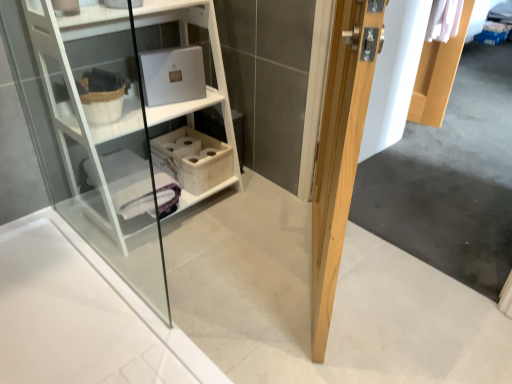
Question: From a real-world perspective, does white wood shelf at upper left sit lower than natural wood door at right?

Choices:
 (A) no
 (B) yes

Answer: (B)

Question: Does white wood shelf at upper left have a greater height compared to natural wood door at right?

Choices:
 (A) no
 (B) yes

Answer: (A)

Question: Is white wood shelf at upper left surrounding natural wood door at right?

Choices:
 (A) no
 (B) yes

Answer: (A)

Question: From a real-world perspective, is white wood shelf at upper left on natural wood door at right?

Choices:
 (A) no
 (B) yes

Answer: (A)

Question: Is white wood shelf at upper left placed right next to natural wood door at right?

Choices:
 (A) yes
 (B) no

Answer: (B)

Question: Does white wood shelf at upper left have a larger size compared to natural wood door at right?

Choices:
 (A) yes
 (B) no

Answer: (A)

Question: Is natural wood door at right looking in the opposite direction of white wood shelf at upper left?

Choices:
 (A) no
 (B) yes

Answer: (B)

Question: Is natural wood door at right placed right next to white wood shelf at upper left?

Choices:
 (A) yes
 (B) no

Answer: (B)

Question: Does natural wood door at right contain white wood shelf at upper left?

Choices:
 (A) no
 (B) yes

Answer: (A)

Question: Is natural wood door at right completely or partially outside of white wood shelf at upper left?

Choices:
 (A) no
 (B) yes

Answer: (B)

Question: Is natural wood door at right to the right of white wood shelf at upper left from the viewer's perspective?

Choices:
 (A) yes
 (B) no

Answer: (A)

Question: Considering the relative positions of natural wood door at right and white wood shelf at upper left in the image provided, is natural wood door at right to the left of white wood shelf at upper left from the viewer's perspective?

Choices:
 (A) yes
 (B) no

Answer: (B)

Question: Would you say white woven basket at center contains natural wood door at right?

Choices:
 (A) no
 (B) yes

Answer: (A)